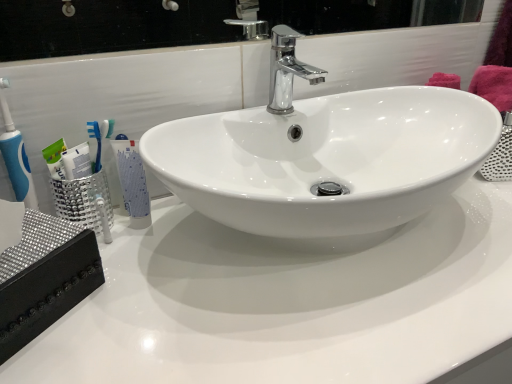
Locate an element on the screen. The image size is (512, 384). empty space that is ontop of white glossy countertop at center (from a real-world perspective) is located at coordinates (283, 285).